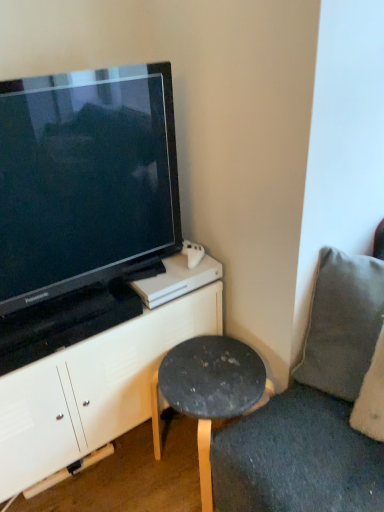
Question: Is gray fabric pillow at right taller than dark gray stone stool at lower right?

Choices:
 (A) no
 (B) yes

Answer: (A)

Question: Does gray fabric pillow at right turn towards dark gray stone stool at lower right?

Choices:
 (A) no
 (B) yes

Answer: (A)

Question: From a real-world perspective, is gray fabric pillow at right beneath dark gray stone stool at lower right?

Choices:
 (A) no
 (B) yes

Answer: (A)

Question: Is gray fabric pillow at right turned away from dark gray stone stool at lower right?

Choices:
 (A) yes
 (B) no

Answer: (B)

Question: From the image's perspective, is gray fabric pillow at right located above dark gray stone stool at lower right?

Choices:
 (A) no
 (B) yes

Answer: (B)

Question: Would you consider gray fabric pillow at right to be distant from dark gray stone stool at lower right?

Choices:
 (A) no
 (B) yes

Answer: (A)

Question: Is black glossy television at upper left facing towards gray fabric pillow at right?

Choices:
 (A) no
 (B) yes

Answer: (A)

Question: Is black glossy television at upper left not near gray fabric pillow at right?

Choices:
 (A) no
 (B) yes

Answer: (A)

Question: Is black glossy television at upper left thinner than gray fabric pillow at right?

Choices:
 (A) no
 (B) yes

Answer: (B)

Question: Is black glossy television at upper left beside gray fabric pillow at right?

Choices:
 (A) no
 (B) yes

Answer: (A)

Question: Is black glossy television at upper left shorter than gray fabric pillow at right?

Choices:
 (A) no
 (B) yes

Answer: (A)

Question: Does black glossy television at upper left appear on the left side of gray fabric pillow at right?

Choices:
 (A) yes
 (B) no

Answer: (A)

Question: From a real-world perspective, does black glossy television at upper left stand above white matte cabinet at upper left?

Choices:
 (A) yes
 (B) no

Answer: (A)